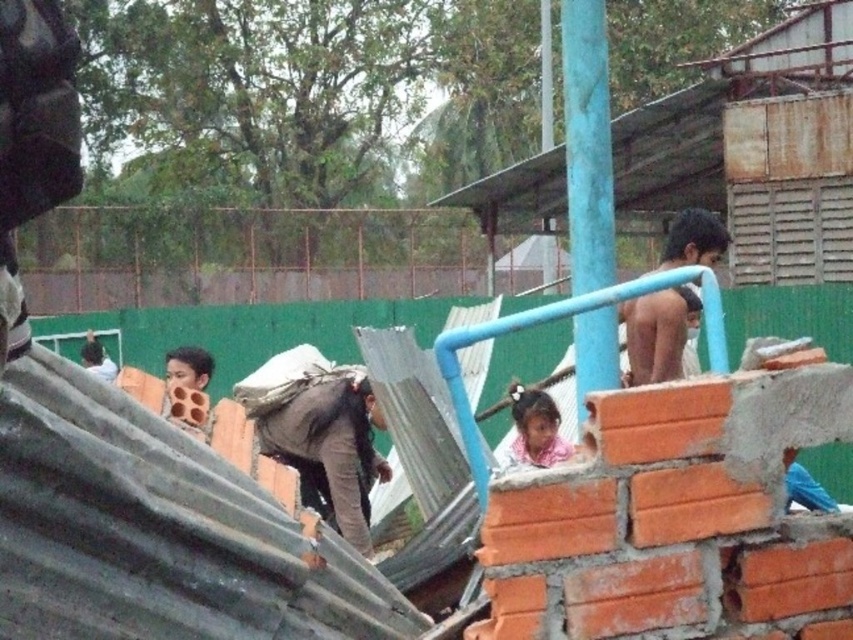
You are a construction worker standing at the base of the partially constructed brick wall. You need to position a new support beam exactly at the midpoint between the blue painted metal pole at upper center and the nearest edge of the brick wall. Where should you place the support beam?

The support beam should be placed halfway between the blue painted metal pole at upper center and the nearest edge of the brick wall. Since the blue painted metal pole at upper center is located at point coordinates, you would calculate the midpoint by averaging the coordinates of the pole and the edge of the wall to determine the exact placement.

You are a safety inspector at the construction site. You notice the blue painted metal pole at upper center and the light brown fabric shirt at left. According to safety protocols, the pole must not be placed above any workers. Is there a safety violation here?

Yes, there is a safety violation because the blue painted metal pole at upper center is positioned over the light brown fabric shirt at left, which violates the safety protocol of not placing poles above workers.